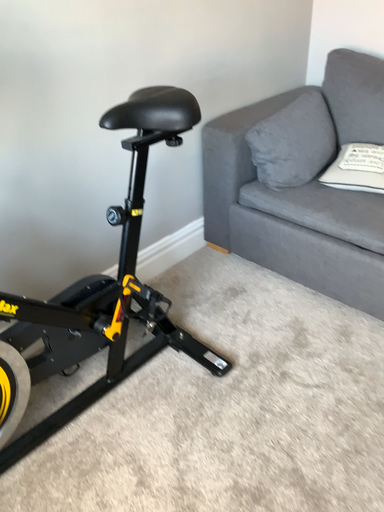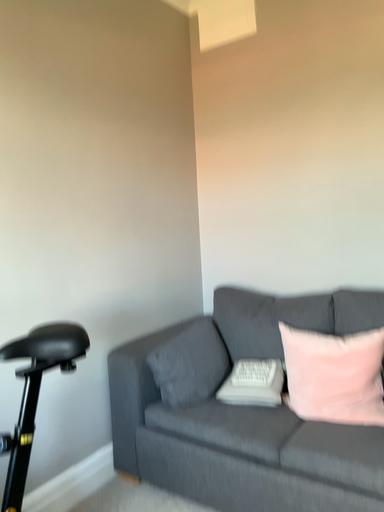
Question: How did the camera likely rotate when shooting the video?

Choices:
 (A) rotated downward
 (B) rotated upward

Answer: (B)